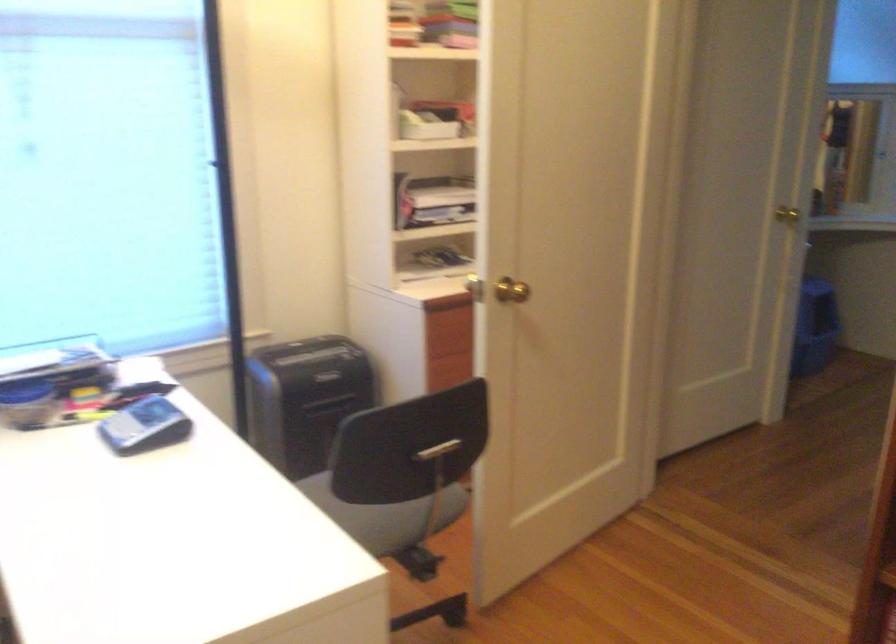
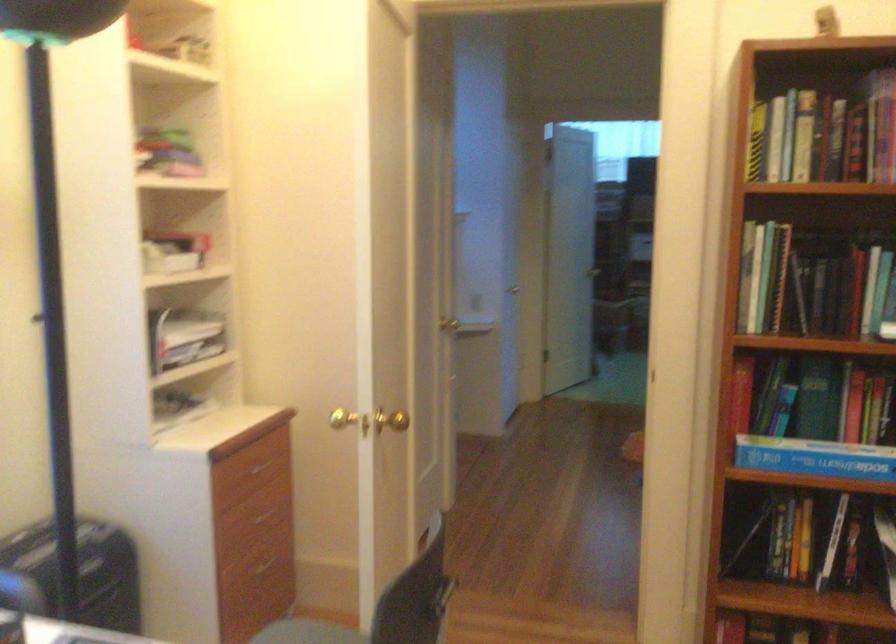
Locate, in the second image, the point that corresponds to (x=787, y=214) in the first image.

(455, 321)